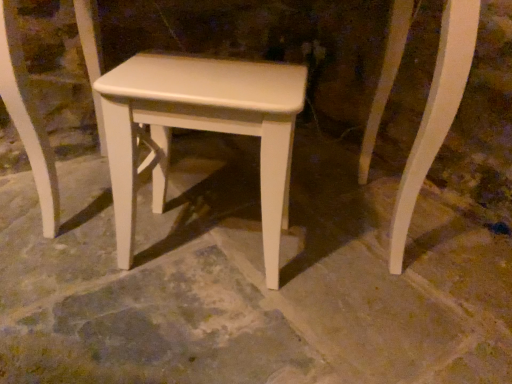
Locate an element on the screen. The height and width of the screenshot is (384, 512). free space above white matte stool at center (from a real-world perspective) is located at coordinates (210, 77).